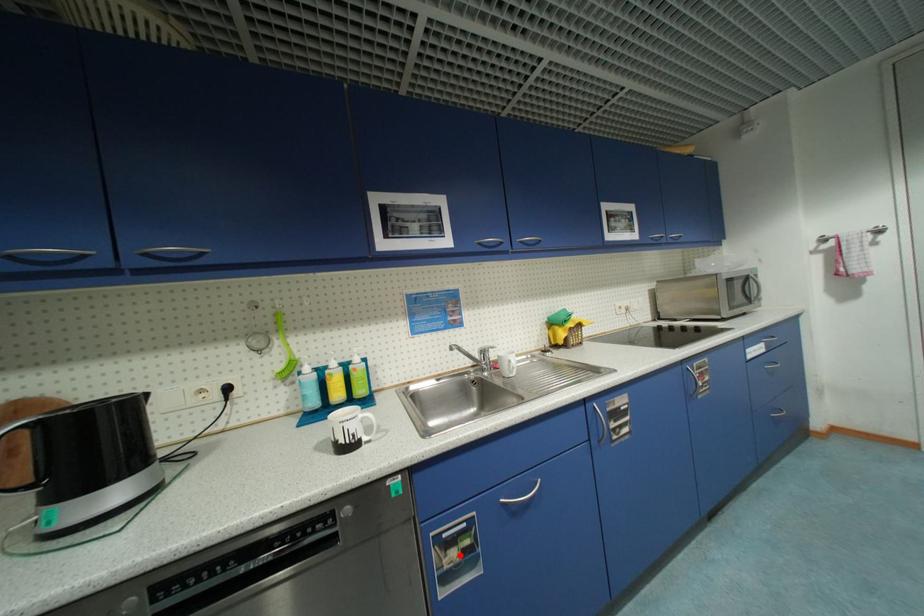
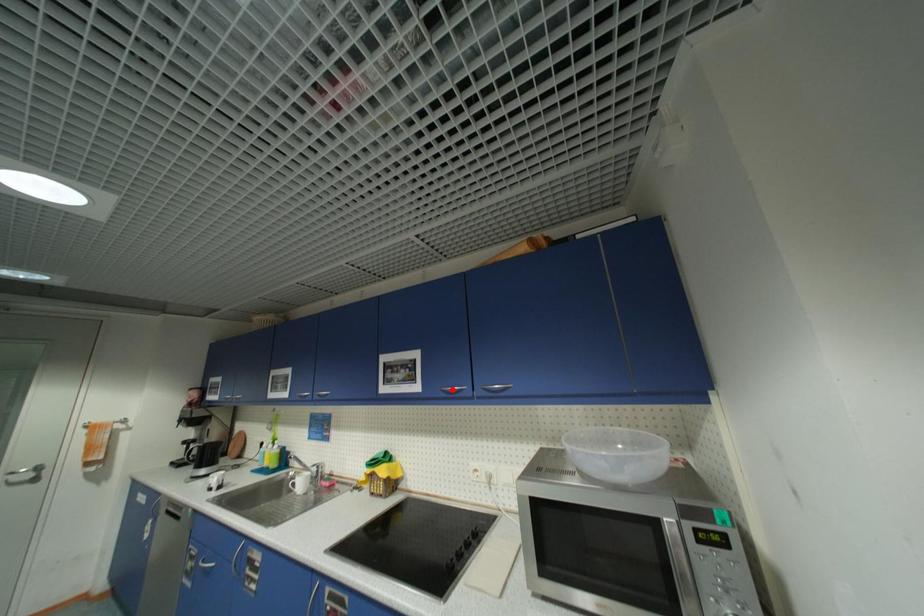
I am providing you with two images of the same scene from different viewpoints. A red point is marked on the first image and another point is marked on the second image. Are the points marked in image1 and image2 representing the same 3D position?

No